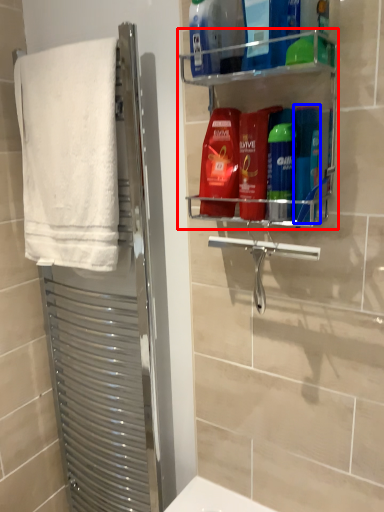
Question: Which of the following is the farthest to the observer, shelf (highlighted by a red box) or toiletry (highlighted by a blue box)?

Choices:
 (A) shelf
 (B) toiletry

Answer: (B)